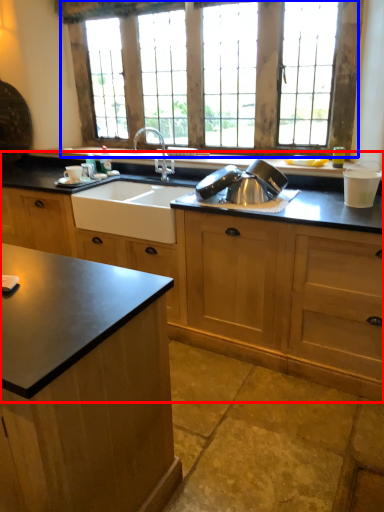
Question: Which object appears closest to the camera in this image, cabinetry (highlighted by a red box) or window (highlighted by a blue box)?

Choices:
 (A) cabinetry
 (B) window

Answer: (A)